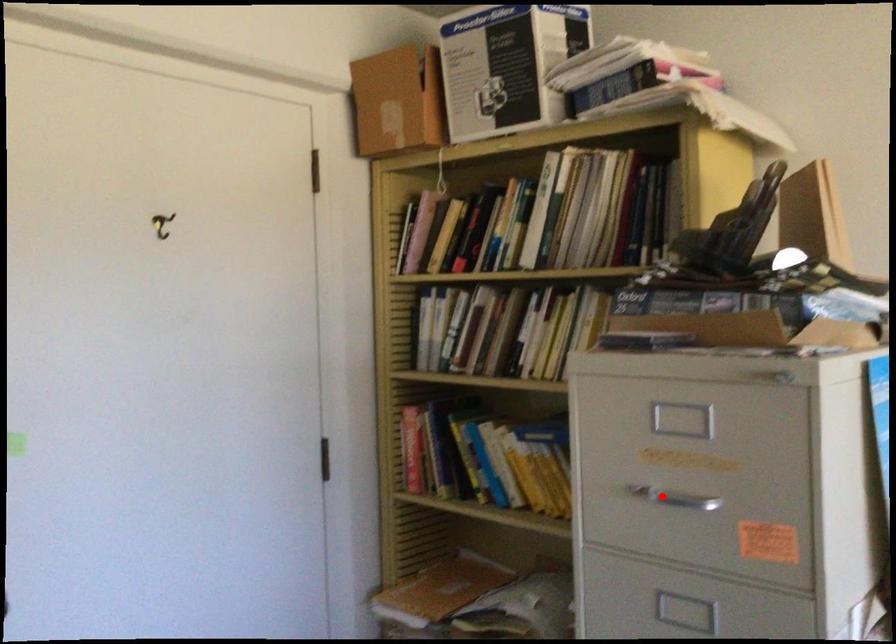
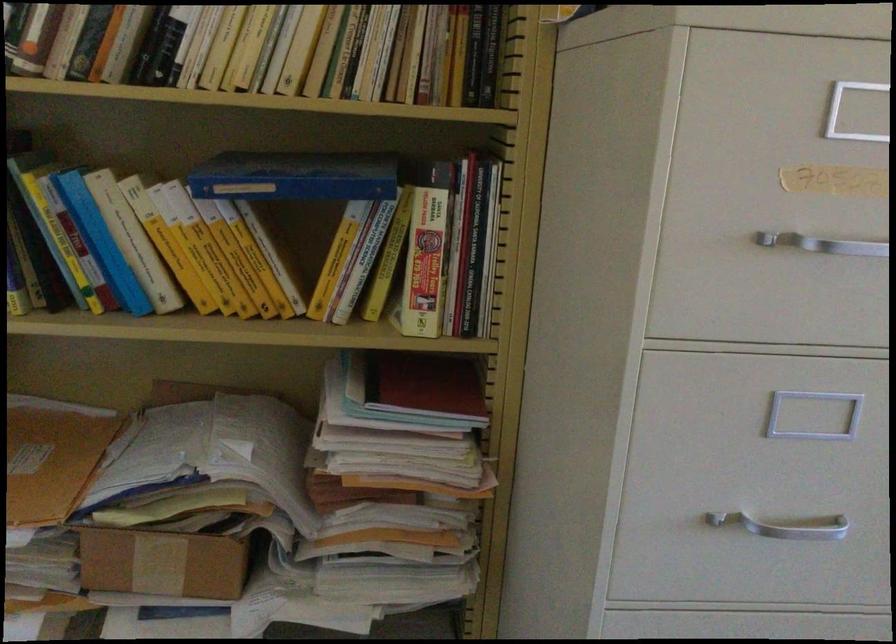
Question: I am providing you with two images of the same scene from different viewpoints. Given a red point in image1, look at the same physical point in image2. Is it:

Choices:
 (A) Closer to the viewpoint
 (B) Farther from the viewpoint

Answer: (A)